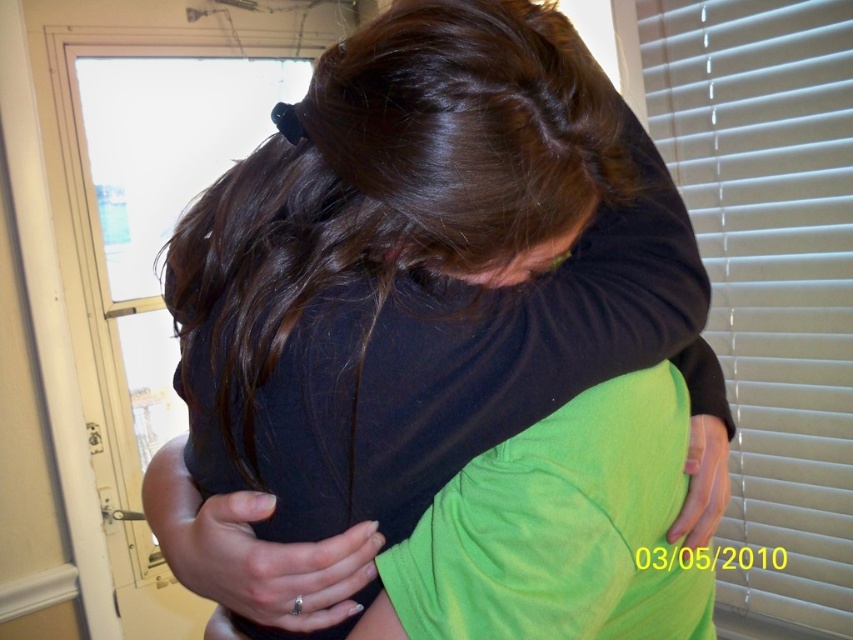
Who is more distant from viewer, (648, 230) or (741, 440)?

Positioned behind is point (741, 440).

Is matte black shirt at center positioned before white blinds at right?

Yes, matte black shirt at center is in front of white blinds at right.

Between point (498, 269) and point (703, 241), which one is positioned in front?

Point (498, 269) is in front.

This screenshot has width=853, height=640. In order to click on matte black shirt at center in this screenshot , I will do `click(415, 300)`.